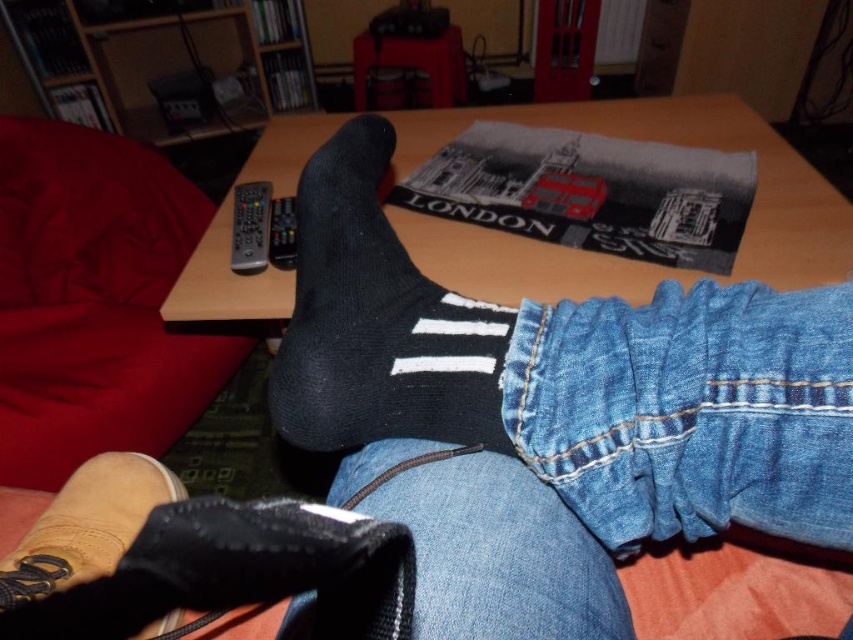
Which of these two, denim at lower right or black plastic remote at center, stands shorter?

With less height is black plastic remote at center.

Can you confirm if denim at lower right is positioned to the right of black plastic remote at center?

Indeed, denim at lower right is positioned on the right side of black plastic remote at center.

Between point (651, 499) and point (294, 259), which one is positioned behind?

The point (294, 259) is behind.

Identify the location of denim at lower right. This screenshot has height=640, width=853. (689, 410).

Does black suede sock at lower left have a lesser width compared to black plastic remote at upper left?

Incorrect, black suede sock at lower left's width is not less than black plastic remote at upper left's.

Between black suede sock at lower left and black plastic remote at upper left, which one is positioned higher?

black plastic remote at upper left is higher up.

Measure the distance between point (53, 637) and camera.

Point (53, 637) and camera are 13.32 inches apart.

Find the location of a particular element. This screenshot has height=640, width=853. black suede sock at lower left is located at coordinates (239, 572).

Can you confirm if denim at lower right is taller than wooden table at center?

In fact, denim at lower right may be shorter than wooden table at center.

Is denim at lower right bigger than wooden table at center?

No, denim at lower right is not bigger than wooden table at center.

Is point (614, 348) closer to camera compared to point (238, 284)?

That is True.

You are a GUI agent. You are given a task and a screenshot of the screen. Output one action in this format:
    pyautogui.click(x=<x>, y=<y>)
    Task: Click on the denim at lower right
    
    Given the screenshot: What is the action you would take?
    pyautogui.click(x=689, y=410)